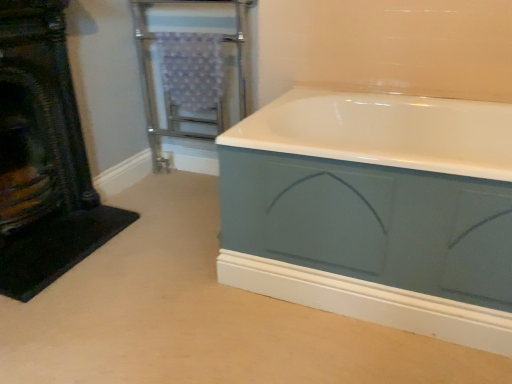
Question: From a real-world perspective, is matte blue bathtub at center above or below metallic silver towel rack at upper left?

Choices:
 (A) below
 (B) above

Answer: (A)

Question: Do you think matte blue bathtub at center is within metallic silver towel rack at upper left, or outside of it?

Choices:
 (A) outside
 (B) inside

Answer: (A)

Question: Considering the real-world distances, which object is closest to the matte blue bathtub at center?

Choices:
 (A) black textured fireplace at left
 (B) metallic silver towel rack at upper left

Answer: (B)

Question: Which object is the farthest from the matte blue bathtub at center?

Choices:
 (A) black textured fireplace at left
 (B) metallic silver towel rack at upper left

Answer: (A)